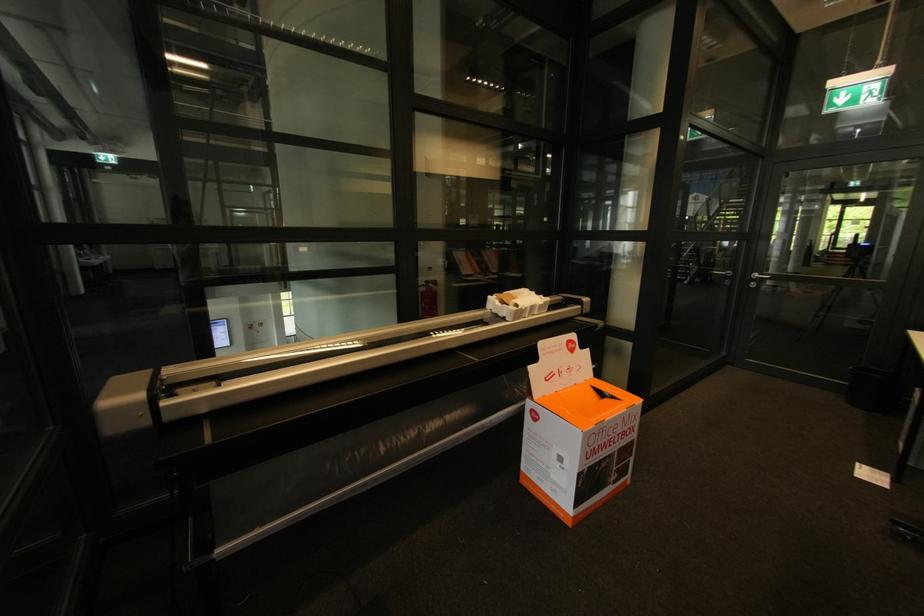
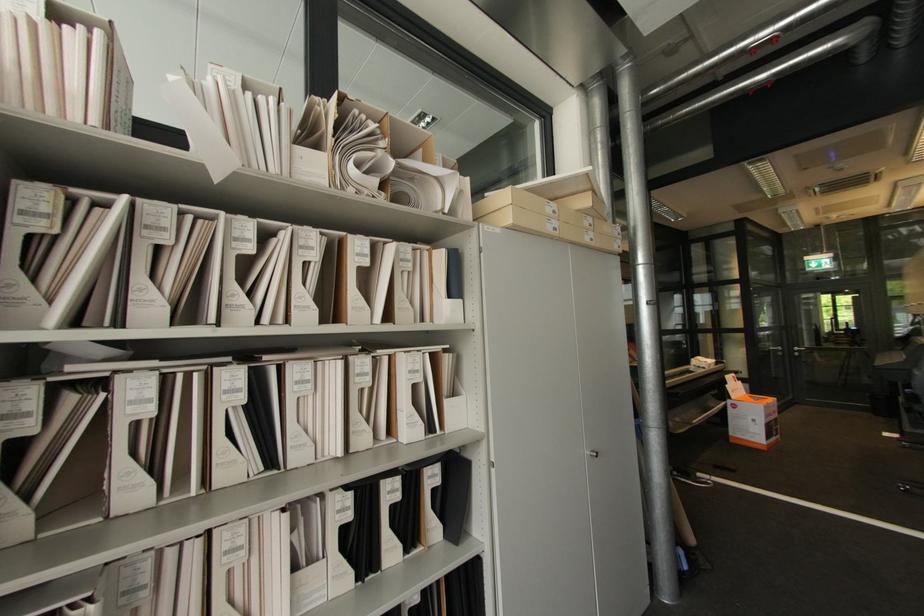
The point at (757, 285) is marked in the first image. Where is the corresponding point in the second image?

(800, 354)